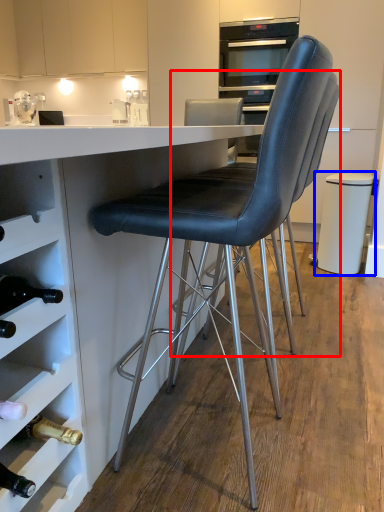
Question: Which object appears farthest to the camera in this image, chair (highlighted by a red box) or bar stool (highlighted by a blue box)?

Choices:
 (A) chair
 (B) bar stool

Answer: (B)